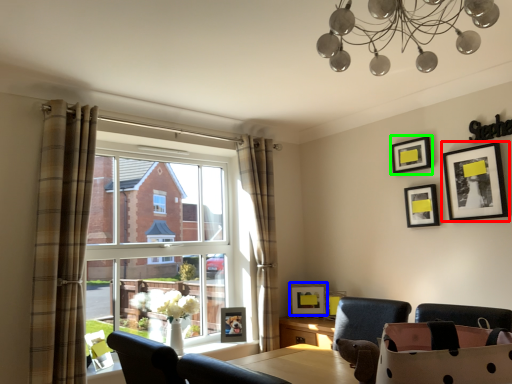
Question: Which object is the farthest from picture frame (highlighted by a red box)? Choose among these: picture frame (highlighted by a blue box) or picture frame (highlighted by a green box).

Choices:
 (A) picture frame
 (B) picture frame

Answer: (A)